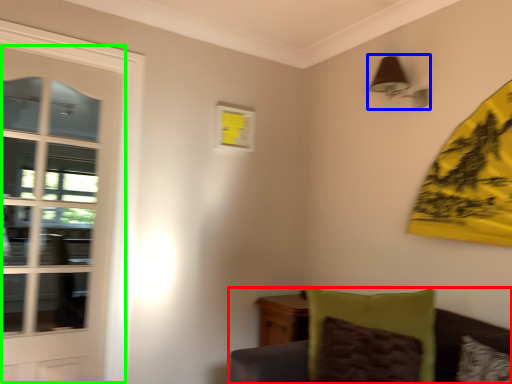
Question: Which is nearer to the furniture (highlighted by a red box)? light fixture (highlighted by a blue box) or door (highlighted by a green box).

Choices:
 (A) light fixture
 (B) door

Answer: (A)